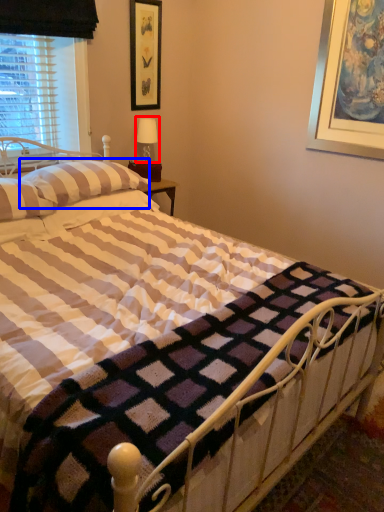
Question: Which object is closer to the camera taking this photo, table lamp (highlighted by a red box) or pillow (highlighted by a blue box)?

Choices:
 (A) table lamp
 (B) pillow

Answer: (B)